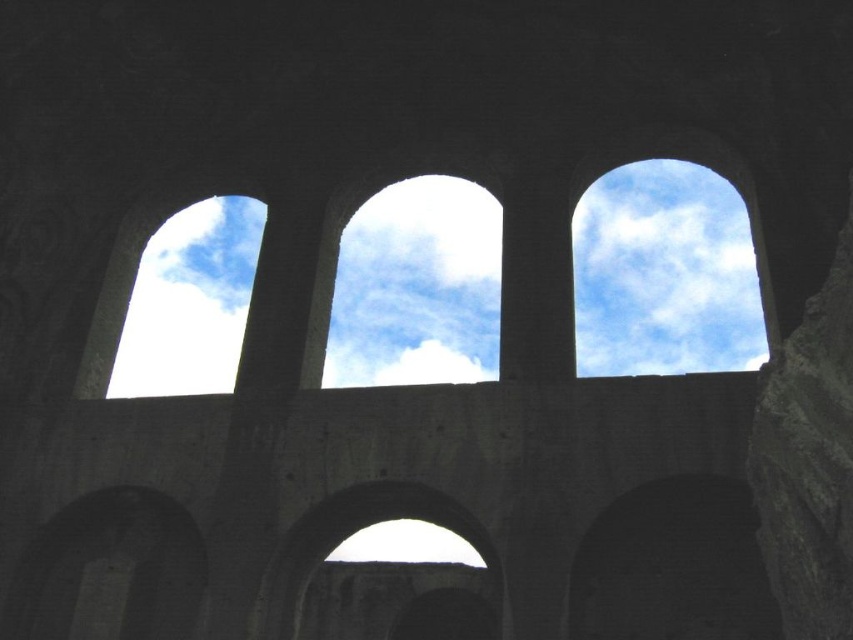
Which is below, white fluffy cloud at upper center or dark gray stone archway at lower left?

dark gray stone archway at lower left

What do you see at coordinates (664, 273) in the screenshot?
I see `white fluffy cloud at upper center` at bounding box center [664, 273].

I want to click on white fluffy cloud at upper center, so click(x=664, y=273).

Does white fluffy cloud at upper center appear under dark stone archway at center?

No.

Between point (329, 336) and point (376, 522), which one is positioned behind?

Positioned behind is point (329, 336).

Which is in front, point (256, 200) or point (393, 506)?

Point (393, 506) is more forward.

This screenshot has height=640, width=853. Find the location of `white fluffy cloud at upper center`. white fluffy cloud at upper center is located at coordinates (664, 273).

From the picture: Who is more forward, (654, 209) or (648, 212)?

Positioned in front is point (654, 209).

Is point (654, 332) less distant than point (653, 275)?

Yes, it is.

This screenshot has width=853, height=640. I want to click on white fluffy cloud at upper center, so click(x=664, y=273).